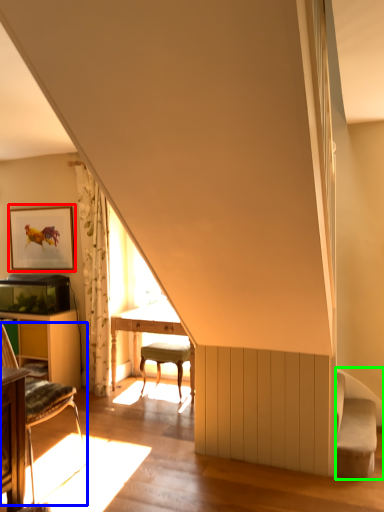
Question: Considering the real-world distances, which object is farthest from picture frame (highlighted by a red box)? chair (highlighted by a blue box) or swivel chair (highlighted by a green box)?

Choices:
 (A) chair
 (B) swivel chair

Answer: (B)